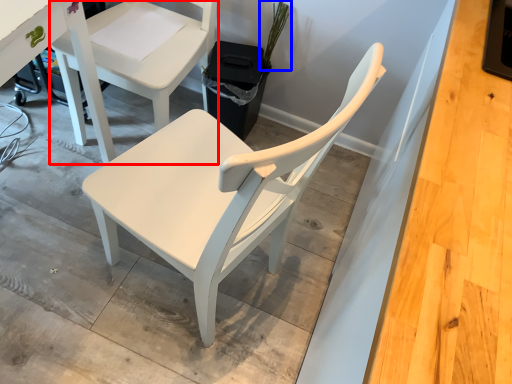
Question: Which point is further to the camera, chair (highlighted by a red box) or plant (highlighted by a blue box)?

Choices:
 (A) chair
 (B) plant

Answer: (B)